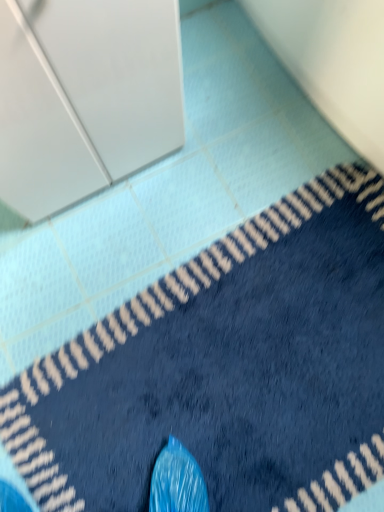
Question: From a real-world perspective, relative to white glossy cabinet at upper left, is blue plush bath mat at lower right vertically above or below?

Choices:
 (A) above
 (B) below

Answer: (B)

Question: Choose the correct answer: Is blue plush bath mat at lower right inside white glossy cabinet at upper left or outside it?

Choices:
 (A) inside
 (B) outside

Answer: (B)

Question: From the image's perspective, is blue plush bath mat at lower right positioned above or below white glossy cabinet at upper left?

Choices:
 (A) below
 (B) above

Answer: (A)

Question: From a real-world perspective, relative to blue plush bath mat at lower right, is white glossy cabinet at upper left vertically above or below?

Choices:
 (A) above
 (B) below

Answer: (A)

Question: Would you say white glossy cabinet at upper left is to the left or to the right of blue plush bath mat at lower right in the picture?

Choices:
 (A) left
 (B) right

Answer: (A)

Question: Is white glossy cabinet at upper left bigger or smaller than blue plush bath mat at lower right?

Choices:
 (A) small
 (B) big

Answer: (B)

Question: In terms of width, does white glossy cabinet at upper left look wider or thinner when compared to blue plush bath mat at lower right?

Choices:
 (A) thin
 (B) wide

Answer: (A)